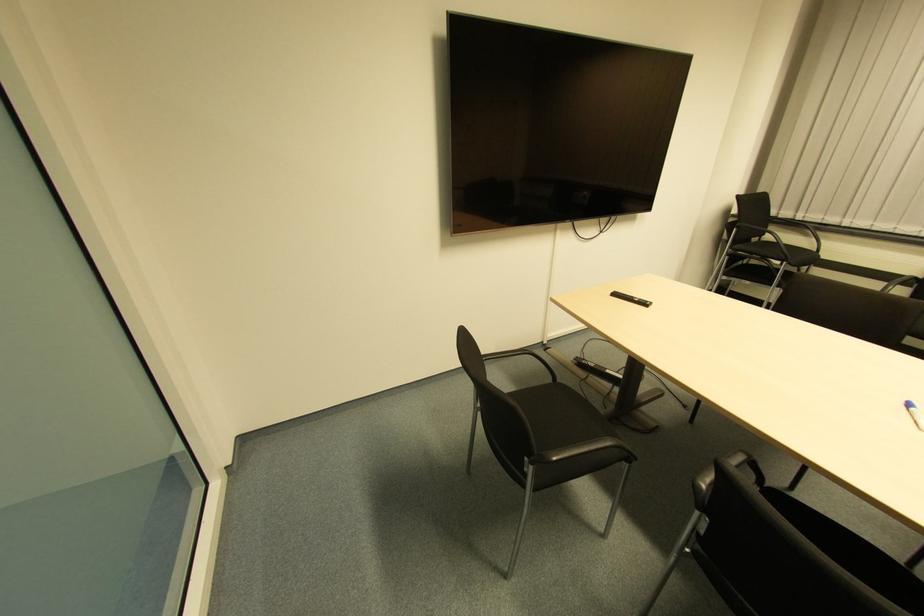
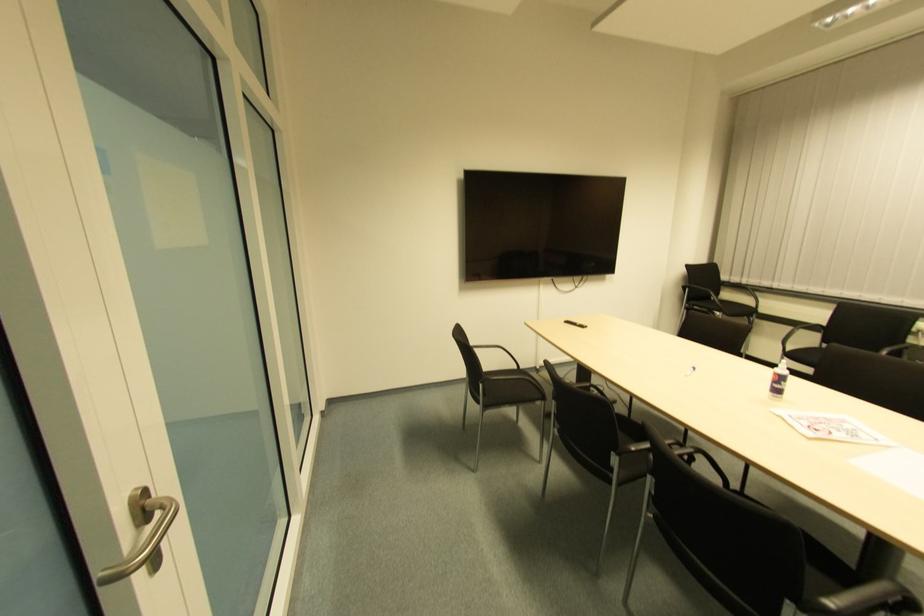
Find the pixel in the second image that matches the point at 728,251 in the first image.

(685, 306)